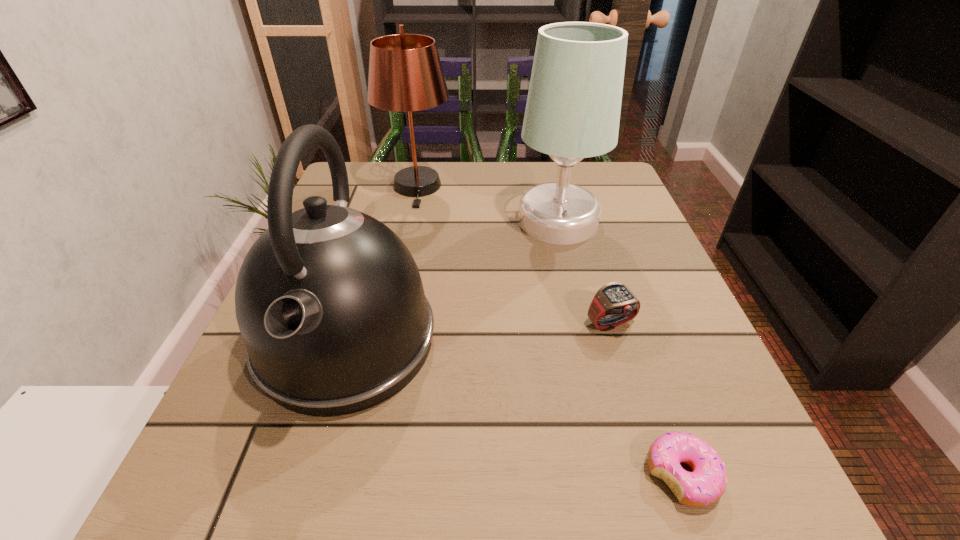
Image resolution: width=960 pixels, height=540 pixels. What are the coordinates of `object positioned at the far right corner` in the screenshot? It's located at (573, 107).

Where is `object at the near right corner`? This screenshot has width=960, height=540. object at the near right corner is located at coordinates pyautogui.click(x=706, y=483).

In the image, there is a desktop. Find the location of `vacant space at the far edge`. vacant space at the far edge is located at coordinates (495, 178).

The width and height of the screenshot is (960, 540). What are the coordinates of `vacant space at the near edge` in the screenshot? It's located at pos(420,476).

Find the location of a particular element. vacant space at the left edge of the desktop is located at coordinates (284, 441).

In the image, there is a desktop. Where is `free space at the right edge`? free space at the right edge is located at coordinates tap(649, 429).

You are a GUI agent. You are given a task and a screenshot of the screen. Output one action in this format:
    pyautogui.click(x=<x>, y=<y>)
    Task: Click on the free space at the far left corner of the desktop
    
    Given the screenshot: What is the action you would take?
    pyautogui.click(x=390, y=180)

The height and width of the screenshot is (540, 960). In the image, there is a desktop. Identify the location of vacant space at the far right corner. (608, 176).

You are a GUI agent. You are given a task and a screenshot of the screen. Output one action in this format:
    pyautogui.click(x=<x>, y=<y>)
    Task: Click on the vacant space at the near right corner
    
    Given the screenshot: What is the action you would take?
    pyautogui.click(x=642, y=463)

Image resolution: width=960 pixels, height=540 pixels. In order to click on vacant point located between the fourth tallest object and the kettle in this screenshot , I will do `click(479, 332)`.